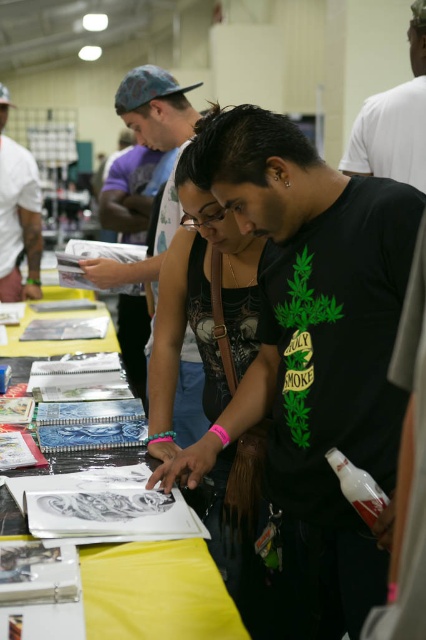
This screenshot has height=640, width=426. I want to click on matte black t-shirt at center, so click(x=161, y=161).

Can you confirm if matte black t-shirt at center is thinner than dark skin tattoo at upper left?

No, matte black t-shirt at center is not thinner than dark skin tattoo at upper left.

Measure the distance between matte black t-shirt at center and camera.

matte black t-shirt at center is 2.07 meters from camera.

This screenshot has width=426, height=640. In order to click on matte black t-shirt at center in this screenshot , I will do `click(161, 161)`.

Who is positioned more to the right, matte black tank top at center or black matte t-shirt at center?

black matte t-shirt at center is more to the right.

Is matte black tank top at center below black matte t-shirt at center?

Indeed, matte black tank top at center is positioned under black matte t-shirt at center.

Measure the distance between point (209, 545) and camera.

5.42 feet

At what (x,y) coordinates should I click in order to perform the action: click on matte black tank top at center. Please return your answer as a coordinate pair (x, y). Looking at the image, I should click on (201, 307).

Who is more distant from viewer, (100, 625) or (20, 280)?

Point (20, 280)

Between yellow paper at center and dark skin tattoo at upper left, which one has more height?

Standing taller between the two is dark skin tattoo at upper left.

Who is more distant from viewer, (178, 586) or (0, 250)?

Positioned behind is point (0, 250).

The image size is (426, 640). I want to click on yellow paper at center, so click(x=157, y=593).